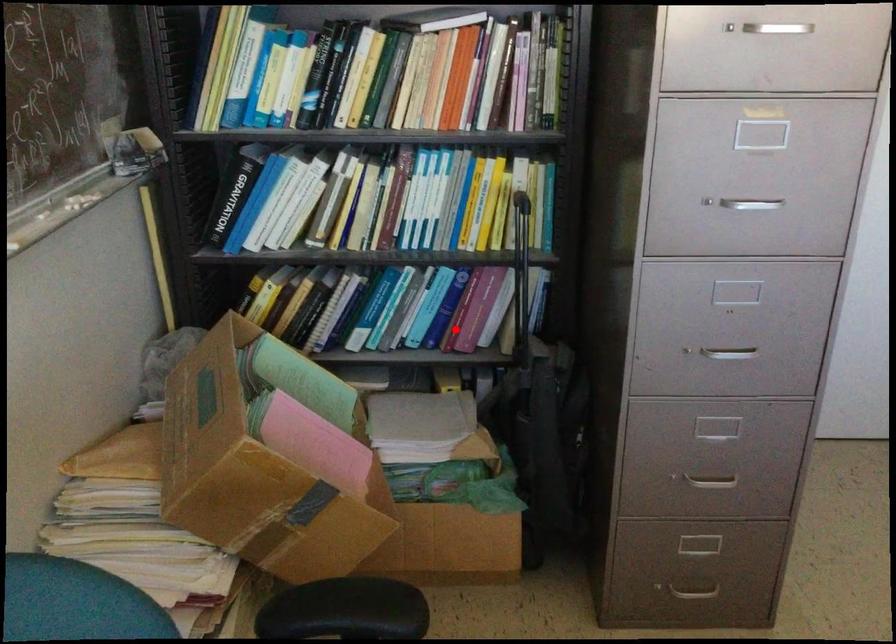
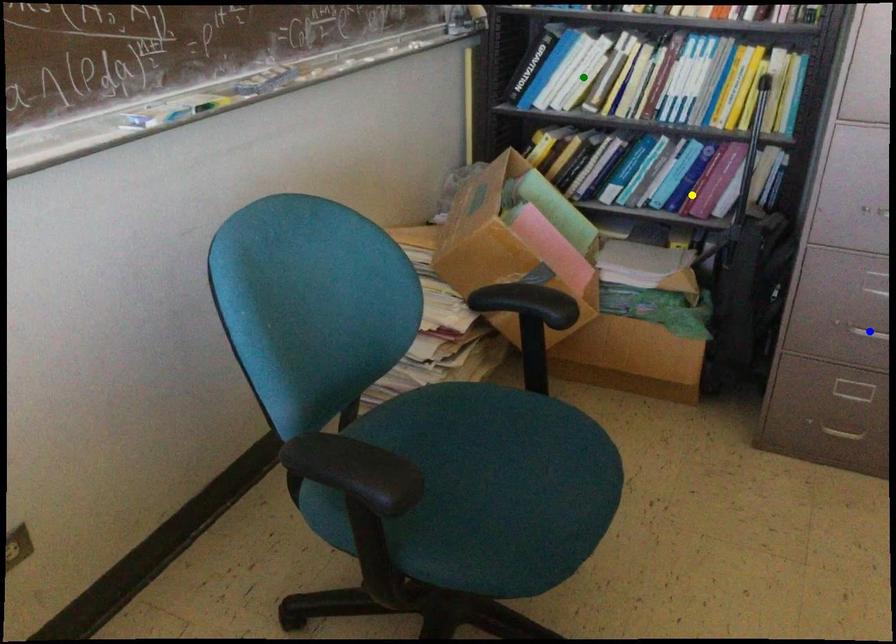
Question: I am providing you with two images of the same scene from different viewpoints. A red point is marked on the first image. You are given multiple points on the second image. Which point in image 2 represents the same 3d spot as the red point in image 1?

Choices:
 (A) green point
 (B) blue point
 (C) yellow point

Answer: (C)